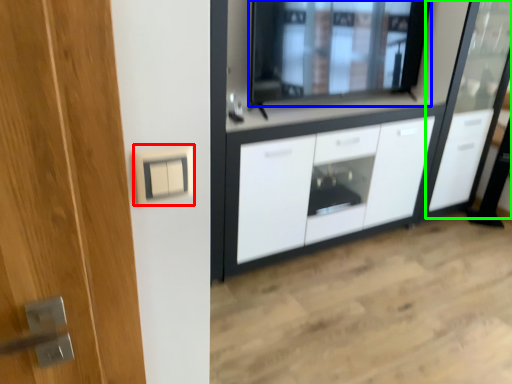
Question: Based on their relative distances, which object is farther from electric outlet (highlighted by a red box)? Choose from window (highlighted by a blue box) and screen door (highlighted by a green box).

Choices:
 (A) window
 (B) screen door

Answer: (B)